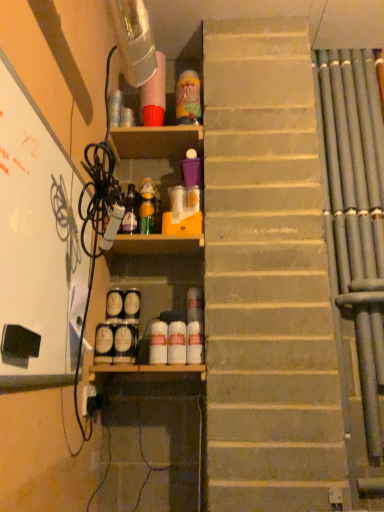
Question: Should I look upward or downward to see white matte bottle at center, which is the third bottle in right-to-left order?

Choices:
 (A) down
 (B) up

Answer: (A)

Question: Can you confirm if matte glass bottle at center, marked as the first bottle in a left-to-right arrangement, is smaller than white matte bottle at center, which appears as the third bottle when viewed from the left?

Choices:
 (A) yes
 (B) no

Answer: (B)

Question: From a real-world perspective, is matte glass bottle at center, the 2th bottle positioned from the top, physically below white matte bottle at center, the 5th bottle positioned from the top?

Choices:
 (A) no
 (B) yes

Answer: (A)

Question: From the image's perspective, is matte glass bottle at center, marked as the first bottle in a left-to-right arrangement, above white matte bottle at center, the 1th bottle from the bottom?

Choices:
 (A) no
 (B) yes

Answer: (B)

Question: Is matte glass bottle at center, the fourth bottle from the bottom, oriented towards white matte bottle at center, which is the third bottle in right-to-left order?

Choices:
 (A) yes
 (B) no

Answer: (B)

Question: Is matte glass bottle at center, acting as the 5th bottle starting from the right, shorter than white matte bottle at center, which is the third bottle in right-to-left order?

Choices:
 (A) no
 (B) yes

Answer: (A)

Question: Considering the relative positions of matte glass bottle at center, marked as the first bottle in a left-to-right arrangement, and white matte bottle at center, which is the third bottle in right-to-left order, in the image provided, is matte glass bottle at center, marked as the first bottle in a left-to-right arrangement, in front of white matte bottle at center, which is the third bottle in right-to-left order,?

Choices:
 (A) no
 (B) yes

Answer: (A)

Question: Is matte glass bottle at center, marked as the first bottle in a left-to-right arrangement, taller than translucent plastic bottle at upper center, marked as the fifth bottle in a left-to-right arrangement?

Choices:
 (A) no
 (B) yes

Answer: (A)

Question: Does matte glass bottle at center, the 2th bottle positioned from the top, have a lesser height compared to translucent plastic bottle at upper center, arranged as the 1th bottle when viewed from the top?

Choices:
 (A) no
 (B) yes

Answer: (B)

Question: From a real-world perspective, is matte glass bottle at center, acting as the 5th bottle starting from the right, beneath translucent plastic bottle at upper center, arranged as the 1th bottle when viewed from the top?

Choices:
 (A) yes
 (B) no

Answer: (A)

Question: Is matte glass bottle at center, acting as the 5th bottle starting from the right, not near translucent plastic bottle at upper center, the 1th bottle when ordered from right to left?

Choices:
 (A) yes
 (B) no

Answer: (B)

Question: From the image's perspective, is matte glass bottle at center, the 2th bottle positioned from the top, below translucent plastic bottle at upper center, arranged as the 1th bottle when viewed from the top?

Choices:
 (A) yes
 (B) no

Answer: (A)

Question: Can you confirm if matte glass bottle at center, the fourth bottle from the bottom, is smaller than translucent plastic bottle at upper center, arranged as the 1th bottle when viewed from the top?

Choices:
 (A) yes
 (B) no

Answer: (A)

Question: Can you confirm if white matte bulletin board at left is positioned to the left of white glossy bottle at center, which is the second bottle from right to left?

Choices:
 (A) no
 (B) yes

Answer: (B)